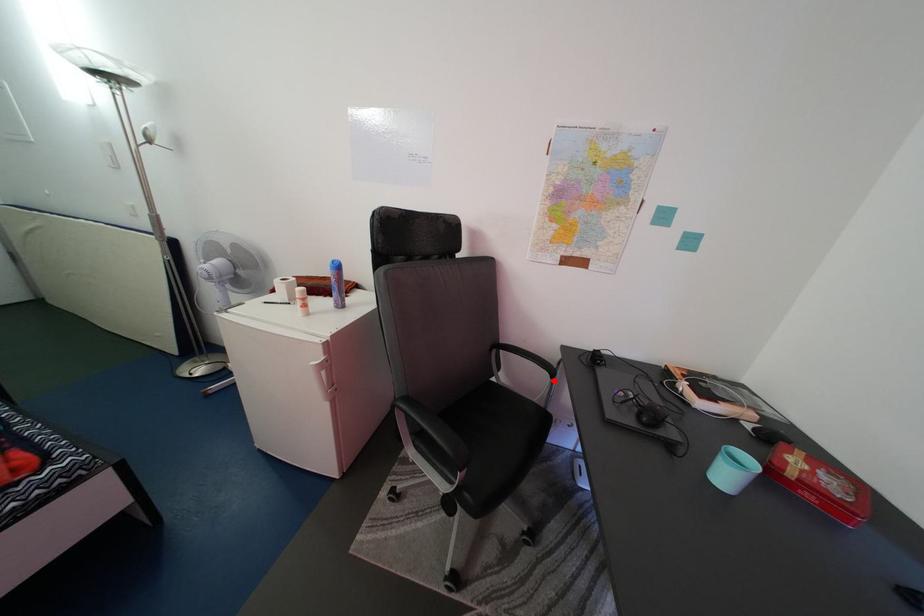
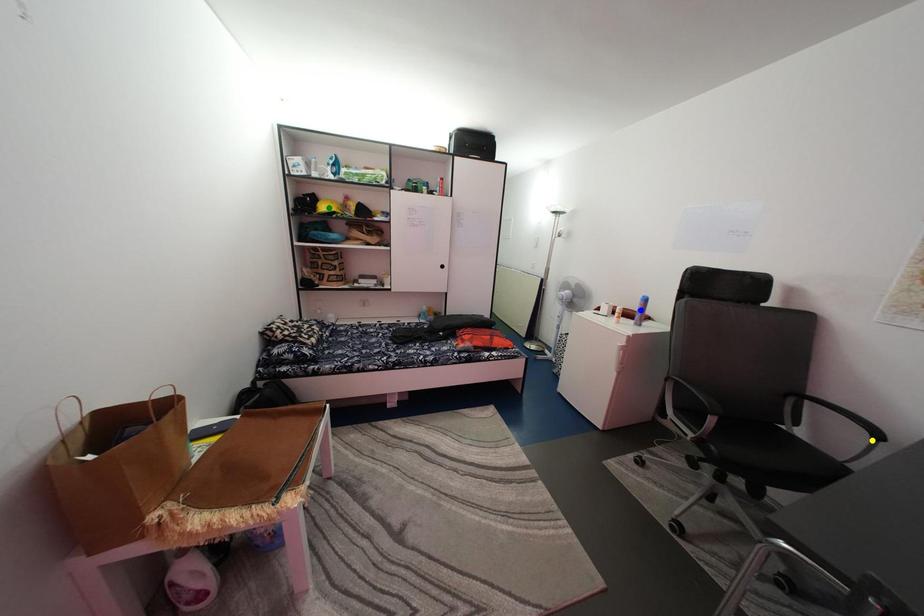
Question: I am providing you with two images of the same scene from different viewpoints. A red point is marked on the first image. You are given multiple points on the second image. Which spot in image 2 lines up with the point in image 1?

Choices:
 (A) blue point
 (B) yellow point
 (C) green point

Answer: (B)